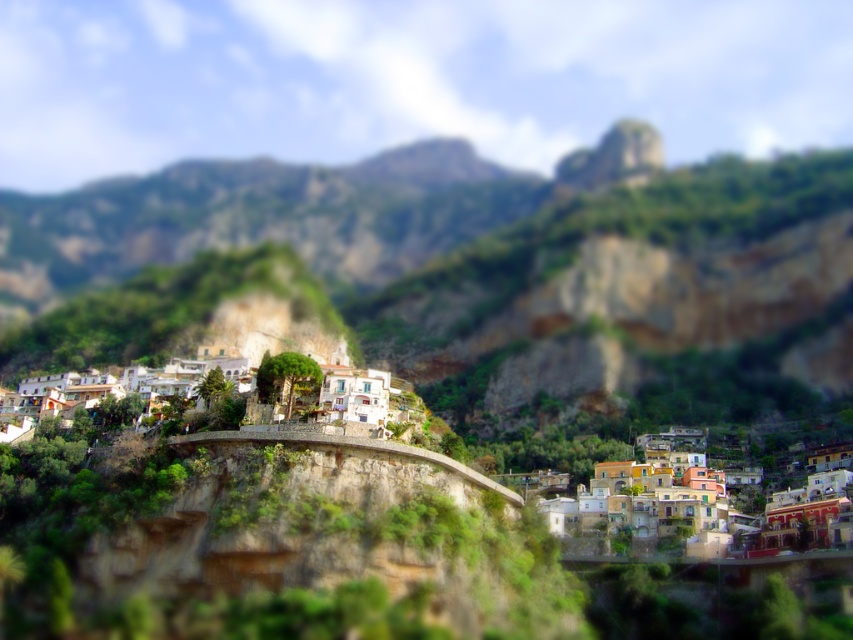
You are standing in the picturesque hillside town and want to determine which of the two points, point (451, 296) or point (79, 372), is closer to you. Based on the scene description, which point is nearer?

Point (451, 296) is further to the viewer than point (79, 372), so the point closer to you is point (79, 372).

You are a tourist standing in the hillside town and want to take a photo of both the green rocky mountain at center and the white stucco houses at center. Which object should you position to your left to include both in the frame?

You should position the white stucco houses at center to your left since the green rocky mountain at center is to the right of them, allowing both to be captured in the photo.

You are a tourist standing at the entrance of the town and want to take a photo that includes both the multicolored stone houses at lower right and the white stucco houses at center. Which group of houses will appear smaller in your photo?

The multicolored stone houses at lower right will appear smaller in the photo because their width is less than that of the white stucco houses at center.